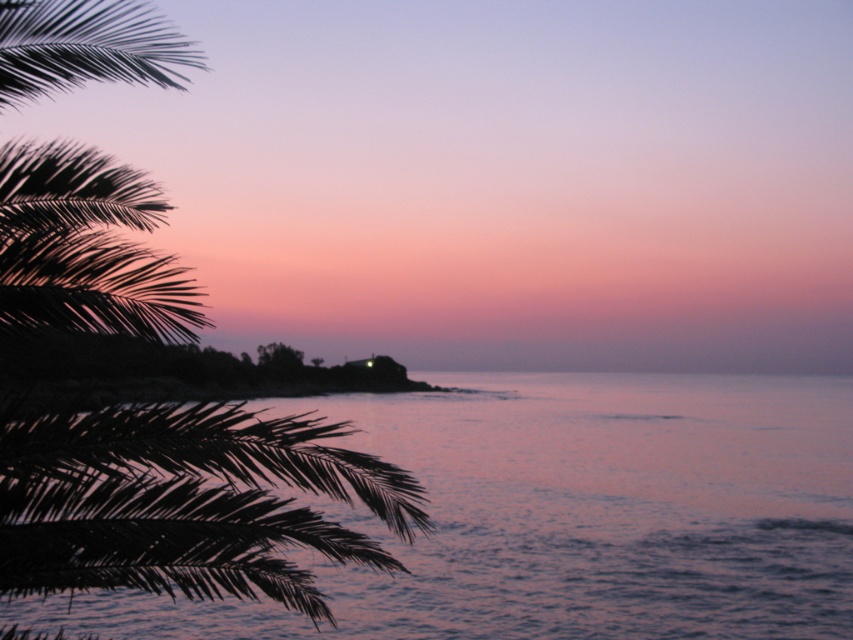
You are a photographer trying to capture the purple water at center in your shot. Based on its coordinates, where should you position your camera to ensure it is centered in the frame?

The purple water at center is located at coordinates point (x=569, y=516). To center it in your frame, position your camera so that the crosshairs align with these coordinates.

You are standing on the beach looking at the purple water at center and the green leafy palm tree at left. Which object appears taller in the scene?

The green leafy palm tree at left appears taller than the purple water at center because the description states that the purple water at center is not as tall as green leafy palm tree at left.

You are a painter standing on the shore and want to paint the purple water at center and the green leafy palm tree at left. Which object should you focus on first if you want to paint the larger one first?

The green leafy palm tree at left is larger than the purple water at center, so you should focus on painting the green leafy palm tree at left first.